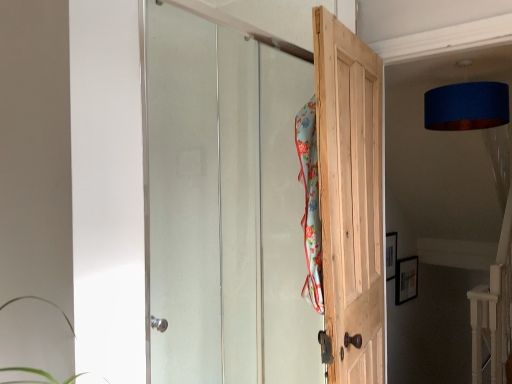
Question: In the image, is blue fabric lampshade at upper right on the left side or the right side of floral fabric beach towel at center?

Choices:
 (A) right
 (B) left

Answer: (A)

Question: Is blue fabric lampshade at upper right wider or thinner than floral fabric beach towel at center?

Choices:
 (A) thin
 (B) wide

Answer: (B)

Question: Based on their relative distances, which object is farther from the natural wood door at center, which appears as the 2th door when viewed from the left?

Choices:
 (A) clear glass door at upper center, arranged as the first door when viewed from the left
 (B) floral fabric beach towel at center
 (C) blue fabric lampshade at upper right

Answer: (C)

Question: Estimate the real-world distances between objects in this image. Which object is closer to the natural wood door at center, arranged as the first door when viewed from the right?

Choices:
 (A) blue fabric lampshade at upper right
 (B) floral fabric beach towel at center
 (C) clear glass door at upper center, the second door when ordered from right to left

Answer: (B)